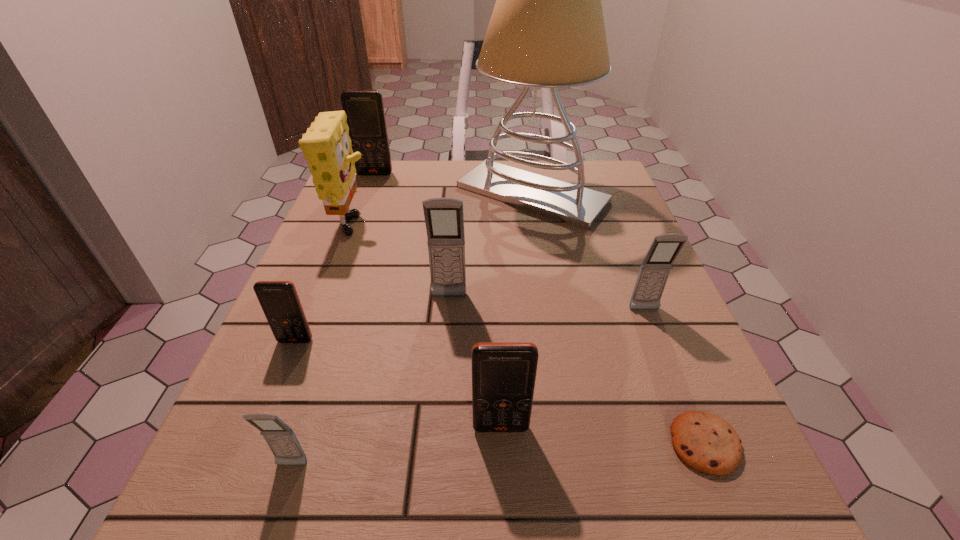
Identify the location of the nearest orange cellular telephone. The image size is (960, 540). (503, 373).

Locate an element on the screen. Image resolution: width=960 pixels, height=540 pixels. the third nearest cellular telephone is located at coordinates (279, 300).

At what (x,y) coordinates should I click in order to perform the action: click on the fourth nearest object. Please return your answer as a coordinate pair (x, y). This screenshot has height=540, width=960. Looking at the image, I should click on (279, 300).

I want to click on the nearest cellular telephone, so click(x=281, y=439).

Where is `the nearest gray cellular telephone`? The width and height of the screenshot is (960, 540). the nearest gray cellular telephone is located at coordinates (281, 439).

Find the location of a particular element. Image resolution: width=960 pixels, height=540 pixels. cookie is located at coordinates (705, 442).

Locate an element on the screen. vacant area located on the left of the beige table lamp is located at coordinates (355, 194).

I want to click on vacant space located 0.270m on the face of the sponge, so click(x=491, y=231).

Where is `vacant space located 0.330m on the front-facing side of the farthest gray cellular telephone`? The image size is (960, 540). vacant space located 0.330m on the front-facing side of the farthest gray cellular telephone is located at coordinates (436, 476).

Locate an element on the screen. This screenshot has height=540, width=960. vacant space located 0.160m on the screen of the farthest orange cellular telephone is located at coordinates (362, 208).